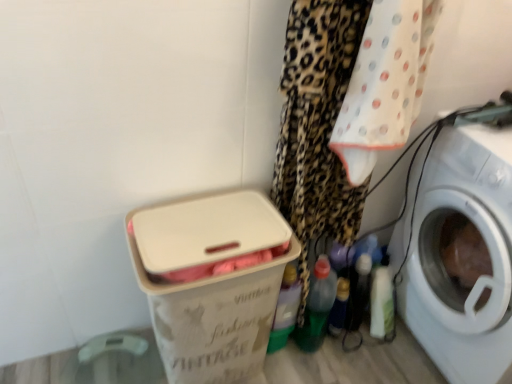
This screenshot has height=384, width=512. What do you see at coordinates (460, 254) in the screenshot?
I see `white plastic washing machine at right` at bounding box center [460, 254].

The height and width of the screenshot is (384, 512). I want to click on white plastic washing machine at right, so click(x=460, y=254).

What do you see at coordinates (339, 307) in the screenshot? I see `translucent plastic bottle at lower center` at bounding box center [339, 307].

The height and width of the screenshot is (384, 512). What are the coordinates of `translucent plastic bottle at lower center` in the screenshot? It's located at (339, 307).

Describe the element at coordinates (210, 281) in the screenshot. This screenshot has height=384, width=512. I see `white plastic laundry basket at lower left` at that location.

What are the coordinates of `white plastic washing machine at right` in the screenshot? It's located at (460, 254).

Could you tell me if white plastic laundry basket at lower left is turned towards white plastic washing machine at right?

No.

Which is behind, point (241, 334) or point (433, 249)?

Point (433, 249)

Is white plastic laundry basket at lower left positioned beyond the bounds of white plastic washing machine at right?

Absolutely, white plastic laundry basket at lower left is external to white plastic washing machine at right.

In the image, there is a translucent plastic bottle at lower center. Identify the location of box above it (from the image's perspective). (210, 281).

What's the angular difference between translucent plastic bottle at lower center and white plastic laundry basket at lower left's facing directions?

The facing directions of translucent plastic bottle at lower center and white plastic laundry basket at lower left are 72.1 degrees apart.

Is white plastic laundry basket at lower left at the back of translucent plastic bottle at lower center?

That's right, translucent plastic bottle at lower center is facing away from white plastic laundry basket at lower left.

Measure the distance between translucent plastic bottle at lower center and white plastic laundry basket at lower left.

The distance of translucent plastic bottle at lower center from white plastic laundry basket at lower left is 22.68 inches.

From a real-world perspective, is white plastic washing machine at right over translucent plastic bottle at lower center?

Yes.

Which is more to the left, white plastic washing machine at right or translucent plastic bottle at lower center?

From the viewer's perspective, translucent plastic bottle at lower center appears more on the left side.

Does white plastic washing machine at right have a greater width compared to translucent plastic bottle at lower center?

Yes, white plastic washing machine at right is wider than translucent plastic bottle at lower center.

Is white plastic washing machine at right turned away from translucent plastic bottle at lower center?

That's not correct — white plastic washing machine at right is not looking away from translucent plastic bottle at lower center.

Image resolution: width=512 pixels, height=384 pixels. In the image, there is a translucent plastic bottle at lower center. Find the location of `box above it (from the image's perspective)`. box above it (from the image's perspective) is located at coordinates (210, 281).

Do you think white plastic laundry basket at lower left is within translucent plastic bottle at lower center, or outside of it?

white plastic laundry basket at lower left exists outside the volume of translucent plastic bottle at lower center.

Considering the relative sizes of white plastic laundry basket at lower left and translucent plastic bottle at lower center in the image provided, is white plastic laundry basket at lower left thinner than translucent plastic bottle at lower center?

In fact, white plastic laundry basket at lower left might be wider than translucent plastic bottle at lower center.

From a real-world perspective, which is physically above, white plastic laundry basket at lower left or translucent plastic bottle at lower center?

white plastic laundry basket at lower left.

What's the angular difference between translucent plastic bottle at lower center and white plastic washing machine at right's facing directions?

The angle between the facing direction of translucent plastic bottle at lower center and the facing direction of white plastic washing machine at right is 164 degrees.

Between translucent plastic bottle at lower center and white plastic washing machine at right, which one has larger width?

With larger width is white plastic washing machine at right.

From a real-world perspective, is translucent plastic bottle at lower center physically located above or below white plastic washing machine at right?

Clearly, from a real-world perspective, translucent plastic bottle at lower center is below white plastic washing machine at right.

Considering the points (340, 297) and (456, 246), which point is in front, point (340, 297) or point (456, 246)?

The point (456, 246) is closer to the camera.

This screenshot has height=384, width=512. Find the location of `washing machine above the white plastic laundry basket at lower left (from a real-world perspective)`. washing machine above the white plastic laundry basket at lower left (from a real-world perspective) is located at coordinates (460, 254).

Which is farther from the camera, (470,127) or (257,234)?

Point (470,127)

Can we say white plastic washing machine at right lies outside white plastic laundry basket at lower left?

Yes, white plastic washing machine at right is not within white plastic laundry basket at lower left.

How different are the orientations of white plastic washing machine at right and white plastic laundry basket at lower left in degrees?

There is a 92.3-degree angle between the facing directions of white plastic washing machine at right and white plastic laundry basket at lower left.

Where is `washing machine that appears in front of the white plastic laundry basket at lower left`? Image resolution: width=512 pixels, height=384 pixels. washing machine that appears in front of the white plastic laundry basket at lower left is located at coordinates (460, 254).

Where is `bottle that appears on the right of white plastic laundry basket at lower left`? Image resolution: width=512 pixels, height=384 pixels. bottle that appears on the right of white plastic laundry basket at lower left is located at coordinates (339, 307).

Based on their spatial positions, is white plastic laundry basket at lower left or translucent plastic bottle at lower center further from white plastic washing machine at right?

Based on the image, white plastic laundry basket at lower left appears to be further to white plastic washing machine at right.

When comparing their distances from translucent plastic bottle at lower center, does white plastic washing machine at right or white plastic laundry basket at lower left seem closer?

white plastic washing machine at right is positioned closer to the anchor translucent plastic bottle at lower center.

From the image, which object appears to be nearer to white plastic washing machine at right, translucent plastic bottle at lower center or white plastic laundry basket at lower left?

translucent plastic bottle at lower center lies closer to white plastic washing machine at right than the other object.

When comparing their distances from translucent plastic bottle at lower center, does white plastic laundry basket at lower left or white plastic washing machine at right seem closer?

white plastic washing machine at right is closer to translucent plastic bottle at lower center.

Considering their positions, is white plastic washing machine at right positioned closer to white plastic laundry basket at lower left than translucent plastic bottle at lower center?

translucent plastic bottle at lower center is closer to white plastic laundry basket at lower left.

From the image, which object appears to be farther from white plastic laundry basket at lower left, translucent plastic bottle at lower center or white plastic washing machine at right?

Based on the image, white plastic washing machine at right appears to be further to white plastic laundry basket at lower left.

Image resolution: width=512 pixels, height=384 pixels. Find the location of `bottle between white plastic laundry basket at lower left and white plastic washing machine at right`. bottle between white plastic laundry basket at lower left and white plastic washing machine at right is located at coordinates (339, 307).